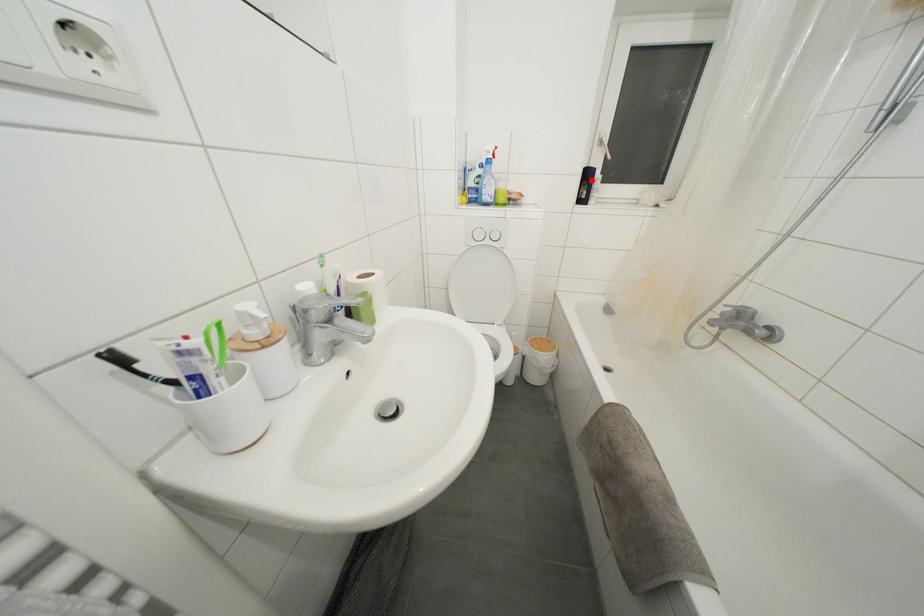
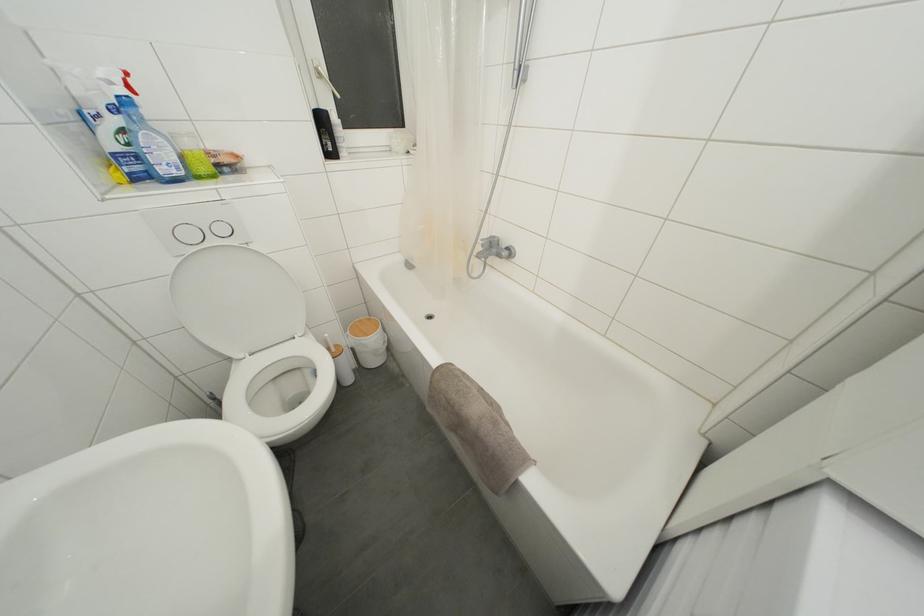
Where in the second image is the point corresponding to the highlighted location from the first image?

(325, 126)